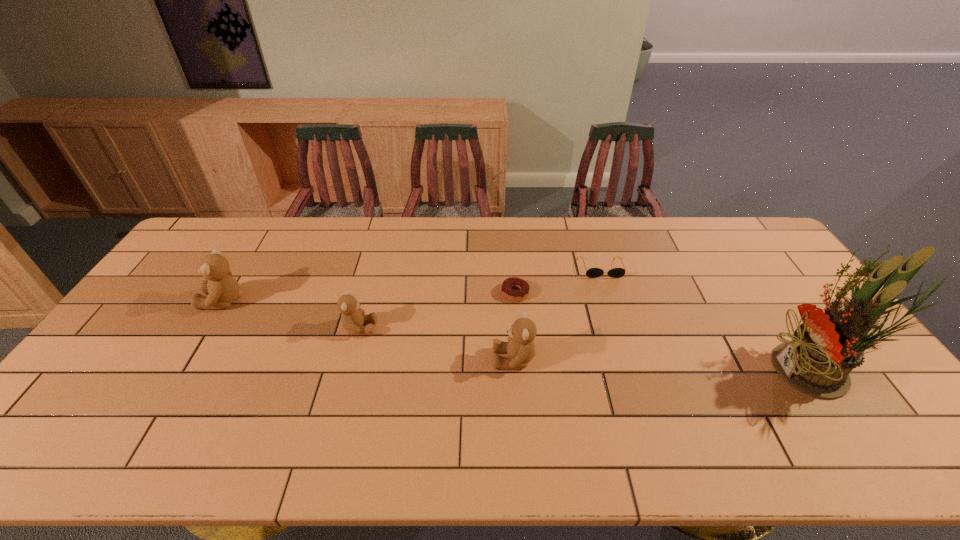
This screenshot has height=540, width=960. I want to click on vacant space located in front of the flower arrangement with the fan visible, so click(667, 372).

Identify the location of object that is at the far edge. The height and width of the screenshot is (540, 960). (592, 272).

Identify the location of object at the near edge. (826, 347).

This screenshot has height=540, width=960. I want to click on object situated at the right edge, so click(826, 347).

I want to click on object that is at the near right corner, so click(826, 347).

In the image, there is a desktop. At what (x,y) coordinates should I click in order to perform the action: click on vacant space at the far edge. Please return your answer as a coordinate pair (x, y). The height and width of the screenshot is (540, 960). Looking at the image, I should click on (379, 247).

You are a GUI agent. You are given a task and a screenshot of the screen. Output one action in this format:
    pyautogui.click(x=<x>, y=<y>)
    Task: Click on the vacant area at the near edge of the desktop
    Image resolution: width=960 pixels, height=540 pixels.
    Given the screenshot: What is the action you would take?
    pyautogui.click(x=588, y=406)

Identify the location of vacant space at the left edge of the desktop. (135, 350).

Locate an element on the screen. This screenshot has width=960, height=540. vacant space at the near right corner is located at coordinates (880, 417).

Locate an element on the screen. The height and width of the screenshot is (540, 960). free space between the flower arrangement and the third tallest object is located at coordinates (666, 366).